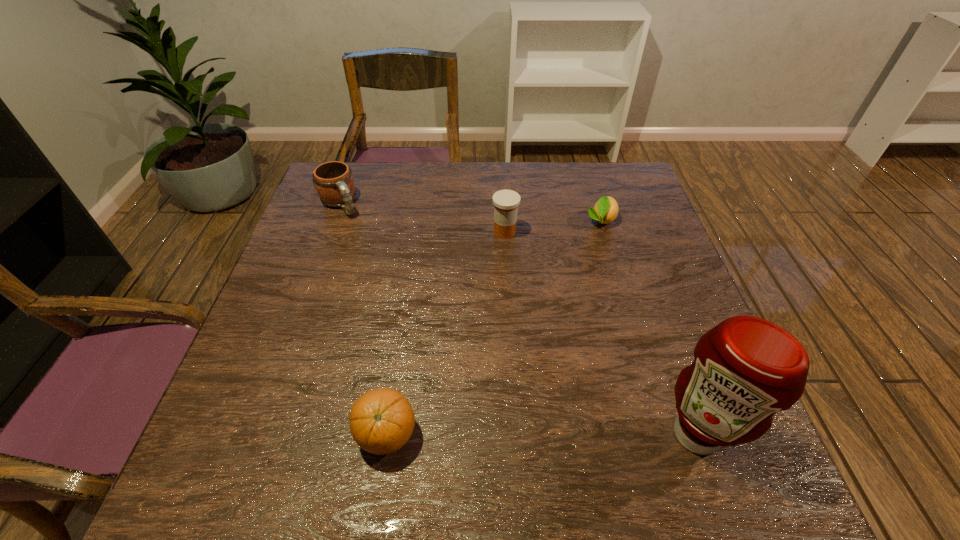
Locate an element on the screen. condiment that is at the right edge is located at coordinates (745, 369).

Locate an element on the screen. lemon present at the right edge is located at coordinates (605, 211).

Find the location of `object that is at the far left corner`. object that is at the far left corner is located at coordinates (334, 183).

This screenshot has height=540, width=960. What are the coordinates of `object that is at the near right corner` in the screenshot? It's located at (745, 369).

In the image, there is a desktop. Identify the location of free space at the far edge. (531, 203).

This screenshot has width=960, height=540. I want to click on free space at the near edge of the desktop, so click(406, 397).

This screenshot has height=540, width=960. I want to click on blank area at the left edge, so coord(271,292).

In the image, there is a desktop. What are the coordinates of `vacant space at the right edge` in the screenshot? It's located at (660, 241).

Identify the location of vacant area at the far left corner of the desktop. (348, 162).

Find the location of a particular element. free spot at the far right corner of the desktop is located at coordinates (628, 178).